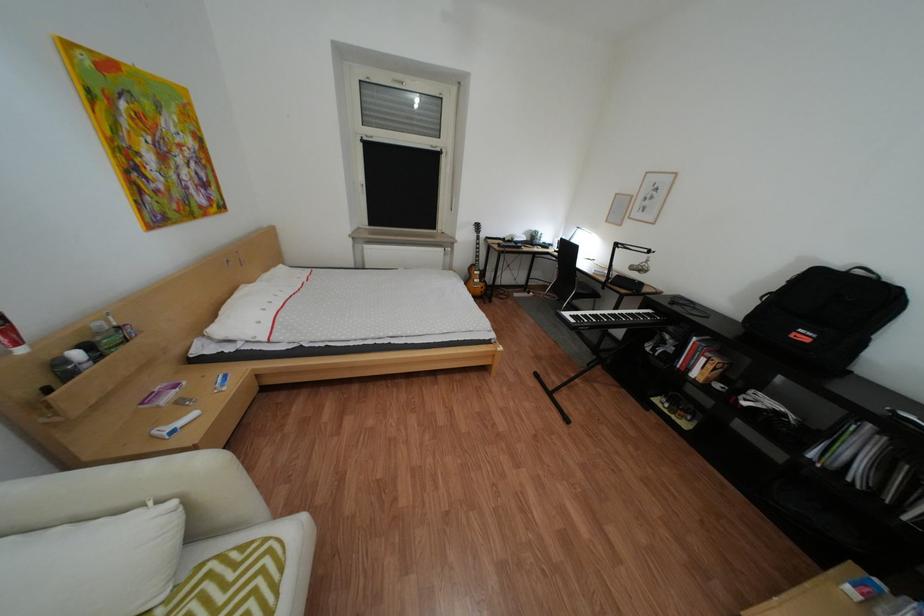
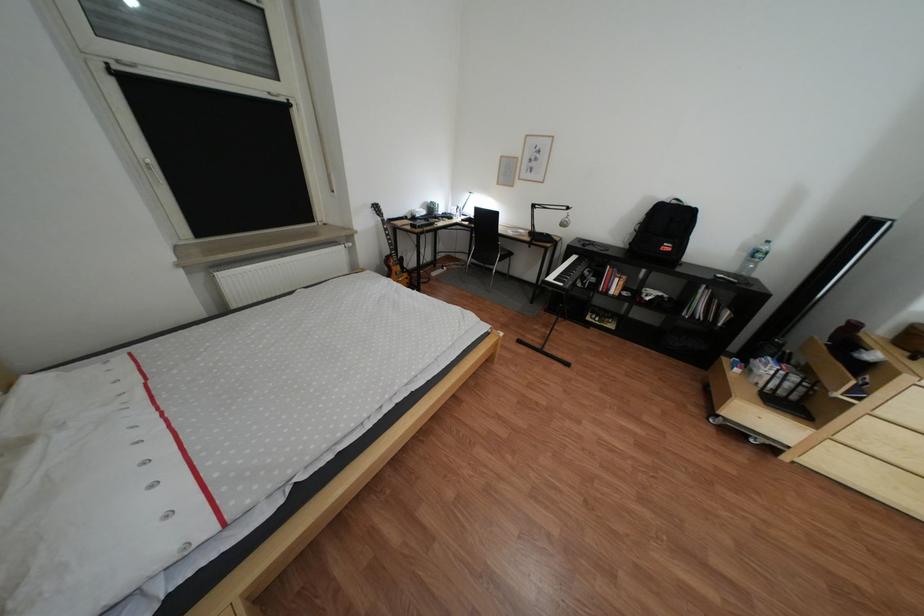
Find the pixel in the second image that matches [827,456] in the first image.

(699, 315)